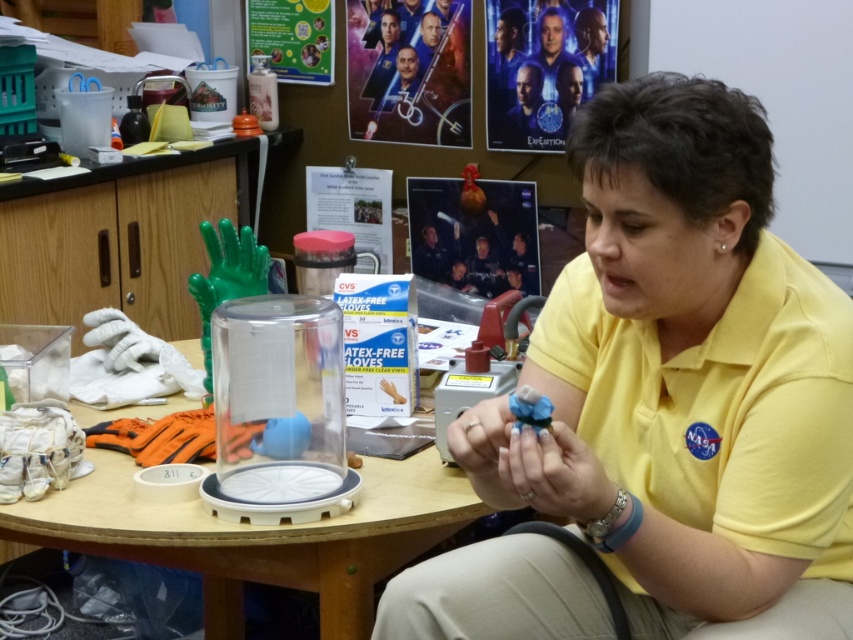
You are an astronaut preparing for a mission and need to check the position of your yellow NASA polo shirt. According to the image, where exactly is the yellow fabric shirt at center positioned?

The yellow fabric shirt at center is located at point [701,368].

You are an astronaut preparing for a mission and need to secure the blue matte object at center. Given that the clear plastic table at center is below it, where should you place your tool to safely retrieve the object without disturbing the table?

You should place your tool beneath the blue matte object at center, as the clear plastic table at center is located below it and can support the tool during retrieval.